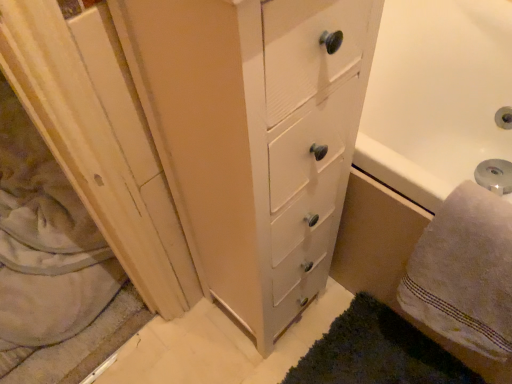
Question: Is wooden screen door at left situated inside dark green shaggy rug at lower right or outside?

Choices:
 (A) outside
 (B) inside

Answer: (A)

Question: From a real-world perspective, is wooden screen door at left positioned above or below dark green shaggy rug at lower right?

Choices:
 (A) above
 (B) below

Answer: (A)

Question: Based on their relative distances, which object is farther from the dark green shaggy rug at lower right?

Choices:
 (A) white fluffy towel at lower right
 (B) wooden screen door at left

Answer: (B)

Question: Which object is positioned farthest from the wooden screen door at left?

Choices:
 (A) white fluffy towel at lower right
 (B) dark green shaggy rug at lower right

Answer: (A)